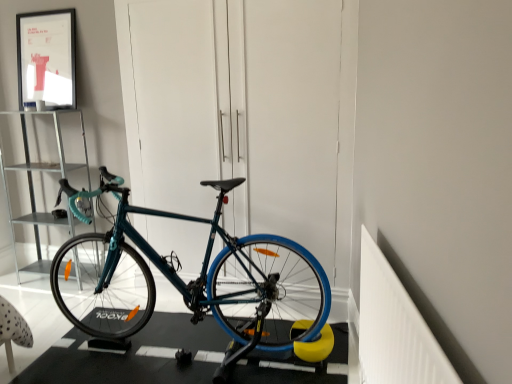
In order to face metallic silver shelf at left, should I rotate leftwards or rightwards?

You should look left and rotate roughly 25.938 degrees.

The width and height of the screenshot is (512, 384). Describe the element at coordinates (47, 59) in the screenshot. I see `matte black picture frame at upper left` at that location.

In order to face teal matte bicycle at center, should I rotate leftwards or rightwards?

Turn left by 10.472 degrees to look at teal matte bicycle at center.

In order to click on metallic silver shelf at left in this screenshot , I will do `click(33, 186)`.

Looking at this image, can you confirm if teal matte bicycle at center is smaller than metallic silver shelf at left?

Incorrect, teal matte bicycle at center is not smaller in size than metallic silver shelf at left.

Between teal matte bicycle at center and metallic silver shelf at left, which one has smaller width?

With smaller width is metallic silver shelf at left.

Could you tell me if teal matte bicycle at center is turned towards metallic silver shelf at left?

No, teal matte bicycle at center does not turn towards metallic silver shelf at left.

Is point (313, 328) closer or farther from the camera than point (48, 217)?

Point (313, 328).

In the image, there is a matte black picture frame at upper left. Where is `bicycle below it (from a real-world perspective)`? The image size is (512, 384). bicycle below it (from a real-world perspective) is located at coordinates (192, 281).

Are teal matte bicycle at center and matte black picture frame at upper left located far from each other?

teal matte bicycle at center is far away from matte black picture frame at upper left.

From a real-world perspective, is teal matte bicycle at center below matte black picture frame at upper left?

Correct, in the physical world, teal matte bicycle at center is lower than matte black picture frame at upper left.

Can you tell me how much teal matte bicycle at center and matte black picture frame at upper left differ in facing direction?

There is a 88.4-degree angle between the facing directions of teal matte bicycle at center and matte black picture frame at upper left.

From a real-world perspective, is metallic silver shelf at left positioned under matte black picture frame at upper left based on gravity?

Yes, from a real-world perspective, metallic silver shelf at left is under matte black picture frame at upper left.

How different are the orientations of metallic silver shelf at left and matte black picture frame at upper left in degrees?

0.000109 degrees separate the facing orientations of metallic silver shelf at left and matte black picture frame at upper left.

Is metallic silver shelf at left taller or shorter than matte black picture frame at upper left?

metallic silver shelf at left is taller than matte black picture frame at upper left.

Considering the relative sizes of matte black picture frame at upper left and metallic silver shelf at left in the image provided, is matte black picture frame at upper left shorter than metallic silver shelf at left?

Yes, matte black picture frame at upper left is shorter than metallic silver shelf at left.

From the image's perspective, is matte black picture frame at upper left above or below metallic silver shelf at left?

matte black picture frame at upper left is situated higher than metallic silver shelf at left in the image.

From the picture: Considering the sizes of objects matte black picture frame at upper left and metallic silver shelf at left in the image provided, who is wider, matte black picture frame at upper left or metallic silver shelf at left?

Wider between the two is metallic silver shelf at left.

From the image's perspective, does matte black picture frame at upper left appear higher than teal matte bicycle at center?

Yes, from the image's perspective, matte black picture frame at upper left is above teal matte bicycle at center.

Considering the sizes of objects matte black picture frame at upper left and teal matte bicycle at center in the image provided, who is smaller, matte black picture frame at upper left or teal matte bicycle at center?

matte black picture frame at upper left.

Which is behind, point (46, 20) or point (225, 267)?

The point (46, 20) is farther from the camera.

From a real-world perspective, which is physically above, metallic silver shelf at left or teal matte bicycle at center?

metallic silver shelf at left is physically above.

Consider the image. Does metallic silver shelf at left come behind teal matte bicycle at center?

→ Yes.

Between metallic silver shelf at left and teal matte bicycle at center, which one has larger width?

teal matte bicycle at center.

From the image's perspective, which is above, metallic silver shelf at left or teal matte bicycle at center?

From the image's view, metallic silver shelf at left is above.

At what (x,y) coordinates should I click in order to perform the action: click on cabinet lying on the left of teal matte bicycle at center. Please return your answer as a coordinate pair (x, y). Looking at the image, I should click on (33, 186).

Find the location of a particular element. The height and width of the screenshot is (384, 512). bicycle that is on the right side of matte black picture frame at upper left is located at coordinates (192, 281).

Estimate the real-world distances between objects in this image. Which object is closer to matte black picture frame at upper left, teal matte bicycle at center or metallic silver shelf at left?

metallic silver shelf at left is positioned closer to the anchor matte black picture frame at upper left.

Looking at the image, which one is located closer to teal matte bicycle at center, metallic silver shelf at left or matte black picture frame at upper left?

metallic silver shelf at left is positioned closer to the anchor teal matte bicycle at center.

Considering their positions, is matte black picture frame at upper left positioned further to metallic silver shelf at left than teal matte bicycle at center?

teal matte bicycle at center is positioned further to the anchor metallic silver shelf at left.

Which object lies nearer to the anchor point matte black picture frame at upper left, metallic silver shelf at left or teal matte bicycle at center?

Among the two, metallic silver shelf at left is located nearer to matte black picture frame at upper left.

When comparing their distances from metallic silver shelf at left, does teal matte bicycle at center or matte black picture frame at upper left seem closer?

matte black picture frame at upper left.

When comparing their distances from teal matte bicycle at center, does matte black picture frame at upper left or metallic silver shelf at left seem closer?

metallic silver shelf at left lies closer to teal matte bicycle at center than the other object.

The width and height of the screenshot is (512, 384). What are the coordinates of `cabinet between matte black picture frame at upper left and teal matte bicycle at center in the up-down direction` in the screenshot? It's located at point(33,186).